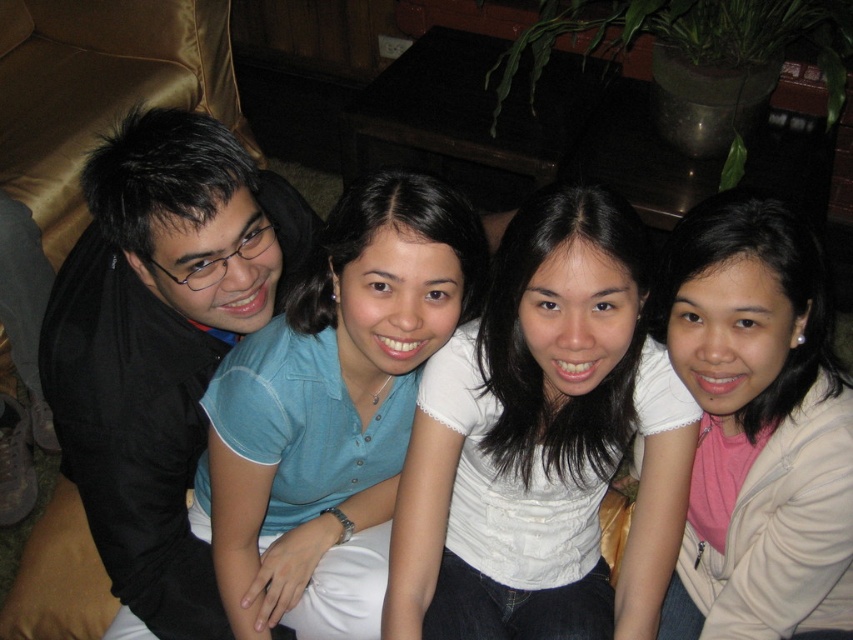
You are organizing a coat rack and need to hang the black matte jacket at left and beige fleece jacket at lower right. Since they are both jackets, which one should you place on top to match their arrangement in the image?

The black matte jacket at left should be placed on top of the beige fleece jacket at lower right because it is positioned over it in the image.

You are a photographer trying to capture a group photo of the four individuals. You want to ensure that the black matte jacket at left and the beige fleece jacket at lower right are not too close to each other. Given that the minimum recommended distance between two jackets in a group photo is 24 inches, is the current spacing between them sufficient?

The black matte jacket at left and beige fleece jacket at lower right are 26.87 inches apart from each other, which exceeds the minimum recommended distance of 24 inches. Therefore, the current spacing between them is sufficient.

You are standing in the living room and want to place a small plant between the two points, point (120, 237) and point (267, 371). Which point is closer to you so you can start placing the plant from there?

Point (120, 237) is closer to the viewer than point (267, 371), so you should start placing the plant from point (120, 237).